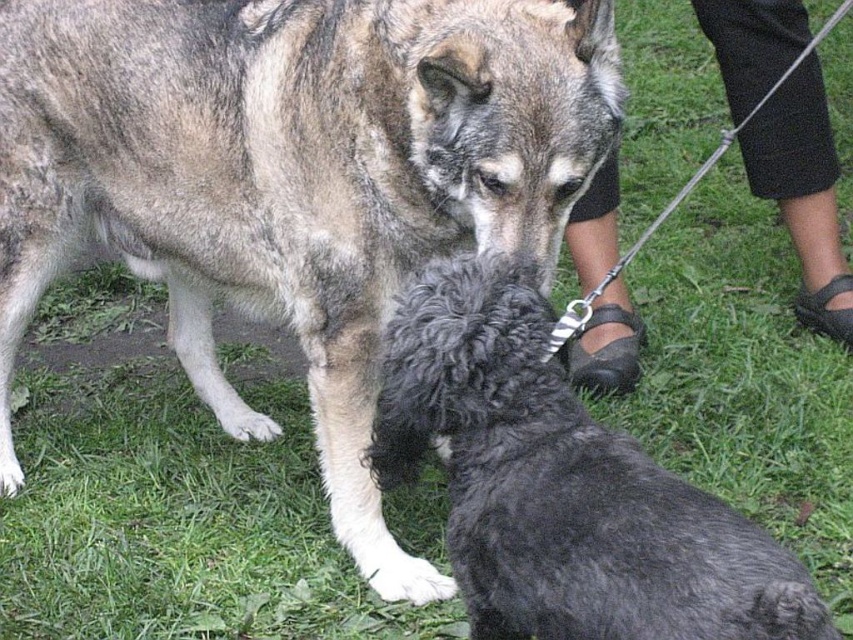
You are a dog owner who wants to ensure your dog has enough space to move freely. You see the shiny black fur at center and the black leather sandals at lower right in the image. Which object takes up more horizontal space?

The shiny black fur at center takes up more horizontal space than the black leather sandals at lower right because its width surpasses the sandals.

You are standing in a park and see the shiny black fur at center and the black leather sandals at lower right. Which object is closer to the ground?

The shiny black fur at center is closer to the ground because it is located below the black leather sandals at lower right.

You are a photographer standing in front of the scene. You see the shiny black fur at center and the black leather sandals at lower right. Which object is closer to the left side of the image?

The shiny black fur at center is closer to the left side of the image because it is positioned to the left of the black leather sandals at lower right.